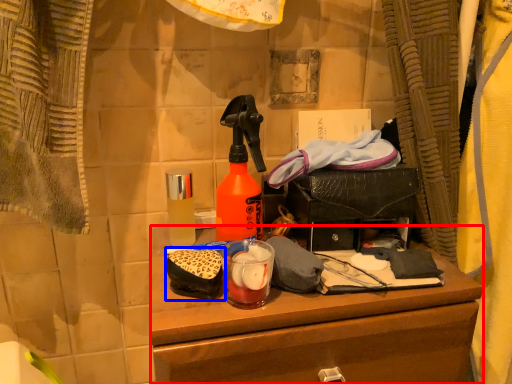
Question: Which object is further to the camera taking this photo, desk (highlighted by a red box) or debris (highlighted by a blue box)?

Choices:
 (A) desk
 (B) debris

Answer: (B)